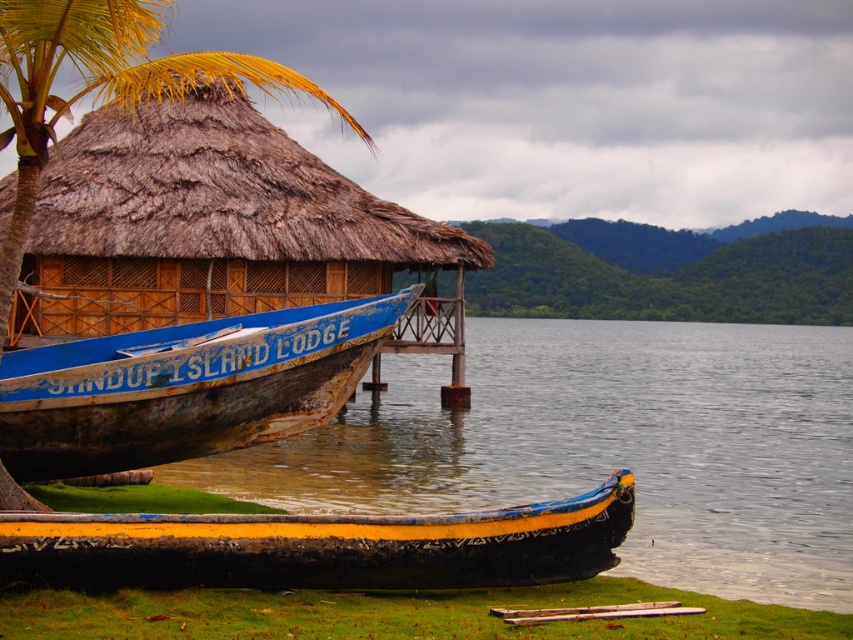
Identify the location of yellow painted wood canoe at lower center. (322, 547).

Who is shorter, yellow painted wood canoe at lower center or wooden at lower center?

wooden at lower center is shorter.

This screenshot has width=853, height=640. What are the coordinates of `yellow painted wood canoe at lower center` in the screenshot? It's located at (322, 547).

Can you confirm if yellow painted wood canoe at lower center is positioned above brown thatch palm tree at upper left?

No.

Who is more distant from viewer, [264,584] or [49,44]?

The point [49,44] is behind.

Between point (254, 579) and point (49, 28), which one is positioned behind?

Point (49, 28)

The image size is (853, 640). Find the location of `yellow painted wood canoe at lower center`. yellow painted wood canoe at lower center is located at coordinates (322, 547).

Can you confirm if rusty wood boat at lower left is wider than brown thatch palm tree at upper left?

In fact, rusty wood boat at lower left might be narrower than brown thatch palm tree at upper left.

Can you confirm if rusty wood boat at lower left is taller than brown thatch palm tree at upper left?

No, rusty wood boat at lower left is not taller than brown thatch palm tree at upper left.

Locate an element on the screen. The height and width of the screenshot is (640, 853). rusty wood boat at lower left is located at coordinates (184, 387).

Find the location of a particular element. The width and height of the screenshot is (853, 640). rusty wood boat at lower left is located at coordinates pyautogui.click(x=184, y=387).